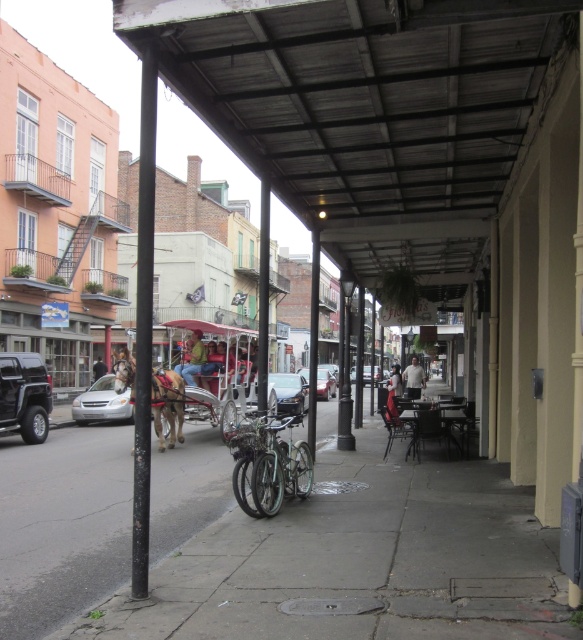
Question: Which point appears farthest from the camera in this image?

Choices:
 (A) (367, 371)
 (B) (75, 403)
 (C) (154, 54)

Answer: (A)

Question: Can you confirm if metallic red cart at center is positioned below metallic silver sedan at center?

Choices:
 (A) no
 (B) yes

Answer: (A)

Question: Does green matte bicycle at center have a lesser width compared to white cotton shirt at center?

Choices:
 (A) yes
 (B) no

Answer: (A)

Question: Which object is farther from the camera taking this photo?

Choices:
 (A) black metal pole at left
 (B) green fabric horse at center
 (C) matte black suv at left
 (D) green matte bicycle at center

Answer: (B)

Question: Which of the following is the farthest from the observer?

Choices:
 (A) matte black suv at left
 (B) dark brown leather jacket at center

Answer: (B)

Question: Does brown glossy horse at center-left have a greater width compared to metallic silver sedan at center?

Choices:
 (A) no
 (B) yes

Answer: (B)